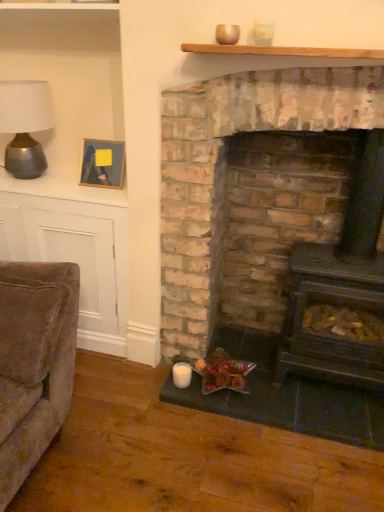
Locate an element on the screen. This screenshot has height=512, width=384. vacant area that lies in front of wooden picture frame at upper left is located at coordinates (92, 194).